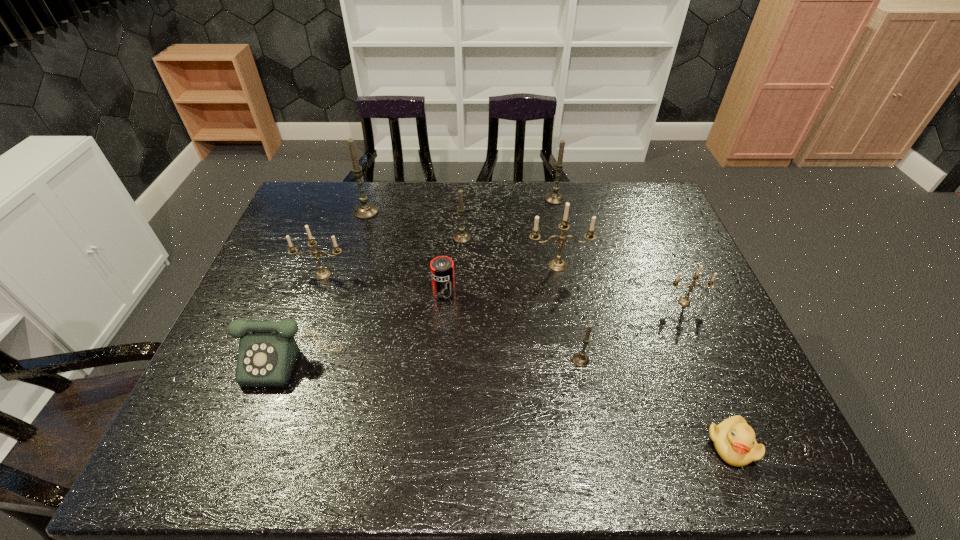
The width and height of the screenshot is (960, 540). What are the coordinates of `free space that is in between the rightmost candle and the second metallic candle from left to right` in the screenshot? It's located at (621, 284).

You are a GUI agent. You are given a task and a screenshot of the screen. Output one action in this format:
    pyautogui.click(x=<x>, y=<y>)
    Task: Click on the free space between the second nearest candle and the second biggest gray candle
    Image resolution: width=960 pixels, height=540 pixels.
    Given the screenshot: What is the action you would take?
    coord(619,251)

You are a GUI agent. You are given a task and a screenshot of the screen. Output one action in this format:
    pyautogui.click(x=<x>, y=<y>)
    Task: Click on the empty location between the second metallic candle from right to left and the nearest candle
    The height and width of the screenshot is (540, 960).
    Given the screenshot: What is the action you would take?
    pyautogui.click(x=569, y=313)

Image resolution: width=960 pixels, height=540 pixels. What are the coordinates of `unoccupied area between the second metallic candle from left to right and the third smallest gray candle` in the screenshot? It's located at (556, 233).

At what (x,y) coordinates should I click in order to perform the action: click on vacant area between the nearest candle and the biggest metallic candle. Please return your answer as a coordinate pair (x, y). The width and height of the screenshot is (960, 540). Looking at the image, I should click on (569, 313).

Identify the location of object that is the sixth nearest to the second biggest gray candle. (580, 359).

Where is `object that ranks as the fourth closest to the biggest gray candle`? The image size is (960, 540). object that ranks as the fourth closest to the biggest gray candle is located at coordinates (267, 354).

Find the location of `the second closest candle to the third farthest object`. the second closest candle to the third farthest object is located at coordinates (366, 210).

This screenshot has height=540, width=960. What are the coordinates of `candle object that ranks as the second closest to the can` in the screenshot? It's located at (557, 265).

The image size is (960, 540). I want to click on gray candle object that ranks as the third closest to the can, so click(x=366, y=210).